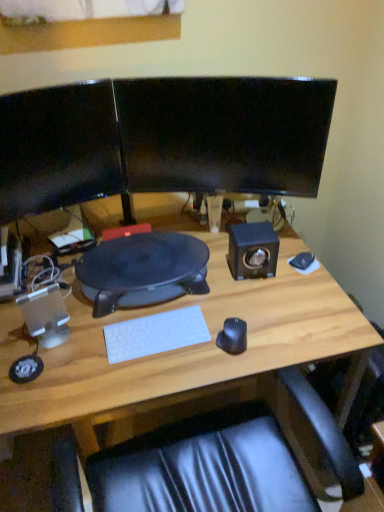
Identify the location of empty space that is in between black matte mouse at center and white matte mousepad at right. Image resolution: width=384 pixels, height=512 pixels. (269, 302).